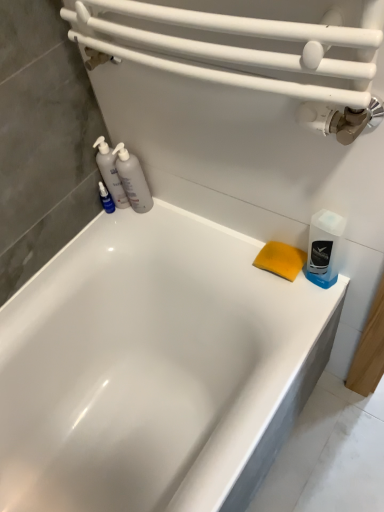
Locate an element on the screen. free space in front of translucent plastic bottles at left, the second cleaning product in the right-to-left sequence is located at coordinates (170, 230).